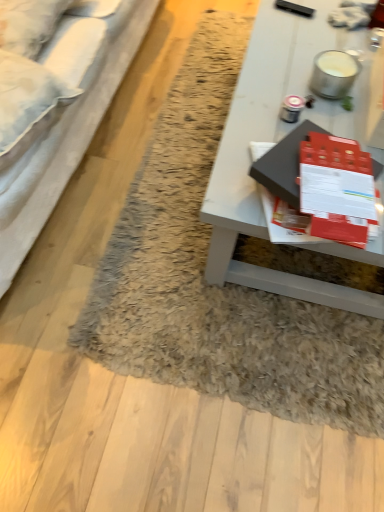
This screenshot has height=512, width=384. What do you see at coordinates (214, 286) in the screenshot?
I see `fuzzy rug at center` at bounding box center [214, 286].

The height and width of the screenshot is (512, 384). Find the location of `matte black book at center`. matte black book at center is located at coordinates (284, 164).

Locate an element on the screen. The image size is (384, 512). white glossy table at center is located at coordinates [274, 141].

You are a GUI agent. You are given a task and a screenshot of the screen. Output one action in this format:
    pyautogui.click(x=<x>, y=<y>)
    Task: Click on the pillow behind the white glossy table at center
    The width and height of the screenshot is (384, 512).
    Given the screenshot: What is the action you would take?
    pyautogui.click(x=29, y=24)

From a real-world perspective, is white fabric pillow at upper left over white glossy table at center?

Indeed, from a real-world perspective, white fabric pillow at upper left stands above white glossy table at center.

Could white glossy table at center be considered to be inside white fabric pillow at upper left?

That's incorrect, white glossy table at center is not inside white fabric pillow at upper left.

Is white glossy table at center at the back of white fabric pillow at upper left?

No, white fabric pillow at upper left's orientation is not away from white glossy table at center.

Can you tell me how much matte black book at center and white fabric pillow at upper left differ in facing direction?

The facing directions of matte black book at center and white fabric pillow at upper left are 86.6 degrees apart.

Based on the photo, from the image's perspective, is matte black book at center positioned above or below white fabric pillow at upper left?

Clearly, from the image's perspective, matte black book at center is below white fabric pillow at upper left.

From a real-world perspective, which is physically below, matte black book at center or white fabric pillow at upper left?

matte black book at center, from a real-world perspective.

Between matte black book at center and white fabric pillow at upper left, which one has smaller size?

Smaller between the two is matte black book at center.

Is white fabric pillow at upper left positioned in front of matte black book at center?

No, white fabric pillow at upper left is further to the viewer.

Between white fabric pillow at upper left and matte black book at center, which one has larger size?

Bigger between the two is white fabric pillow at upper left.

Is white fabric pillow at upper left touching matte black book at center?

white fabric pillow at upper left and matte black book at center are not in contact.

The height and width of the screenshot is (512, 384). I want to click on mat behind the white fabric studio couch at left, so click(214, 286).

Considering the relative positions of fuzzy rug at center and white fabric studio couch at left in the image provided, is fuzzy rug at center to the left of white fabric studio couch at left from the viewer's perspective?

In fact, fuzzy rug at center is to the right of white fabric studio couch at left.

Is fuzzy rug at center located outside white fabric studio couch at left?

Yes, fuzzy rug at center is located beyond the bounds of white fabric studio couch at left.

Between fuzzy rug at center and matte black book at center, which one is positioned in front?

matte black book at center is in front.

Is matte black book at center located within fuzzy rug at center?

Definitely not — matte black book at center is not inside fuzzy rug at center.

Does point (201, 274) come closer to viewer compared to point (296, 200)?

No.

Is fuzzy rug at center positioned far away from matte black book at center?

No.

At what (x,y) coordinates should I click in order to perform the action: click on table that is under the white fabric pillow at upper left (from a real-world perspective). Please return your answer as a coordinate pair (x, y). Looking at the image, I should click on (274, 141).

Can you confirm if white glossy table at center is wider than white fabric pillow at upper left?

Correct, the width of white glossy table at center exceeds that of white fabric pillow at upper left.

From the image's perspective, who appears lower, white glossy table at center or white fabric pillow at upper left?

white glossy table at center is shown below in the image.

From a real-world perspective, is white glossy table at center above or below white fabric pillow at upper left?

In terms of real-world spatial position, white glossy table at center is below white fabric pillow at upper left.

Is white glossy table at center with white fabric studio couch at left?

No.

Considering the sizes of objects white glossy table at center and white fabric studio couch at left in the image provided, who is taller, white glossy table at center or white fabric studio couch at left?

Standing taller between the two is white fabric studio couch at left.

From a real-world perspective, between white glossy table at center and white fabric studio couch at left, who is vertically lower?

From a 3D spatial view, white glossy table at center is below.

Between white glossy table at center and white fabric studio couch at left, which one appears on the right side from the viewer's perspective?

From the viewer's perspective, white glossy table at center appears more on the right side.

Where is `table lying below the white fabric pillow at upper left (from the image's perspective)`? table lying below the white fabric pillow at upper left (from the image's perspective) is located at coordinates (274, 141).

This screenshot has height=512, width=384. In order to click on magazine located underneath the white fabric pillow at upper left (from a real-world perspective) in this screenshot , I will do `click(284, 164)`.

When comparing their distances from fuzzy rug at center, does white fabric pillow at upper left or white glossy table at center seem further?

The object further to fuzzy rug at center is white fabric pillow at upper left.

Looking at the image, which one is located further to matte black book at center, white fabric studio couch at left or white fabric pillow at upper left?

Based on the image, white fabric pillow at upper left appears to be further to matte black book at center.

Considering their positions, is white fabric pillow at upper left positioned closer to fuzzy rug at center than white fabric studio couch at left?

white fabric studio couch at left.

Which object lies nearer to the anchor point fuzzy rug at center, white fabric pillow at upper left or matte black book at center?

matte black book at center is positioned closer to the anchor fuzzy rug at center.

Estimate the real-world distances between objects in this image. Which object is closer to fuzzy rug at center, matte black book at center or white glossy table at center?

white glossy table at center is closer to fuzzy rug at center.

Considering their positions, is fuzzy rug at center positioned closer to matte black book at center than white glossy table at center?

Based on the image, white glossy table at center appears to be nearer to matte black book at center.

When comparing their distances from white fabric pillow at upper left, does matte black book at center or white glossy table at center seem further?

matte black book at center.

From the image, which object appears to be nearer to fuzzy rug at center, white fabric studio couch at left or matte black book at center?

white fabric studio couch at left is closer to fuzzy rug at center.

You are a GUI agent. You are given a task and a screenshot of the screen. Output one action in this format:
    pyautogui.click(x=<x>, y=<y>)
    Task: Click on the mat between white fabric pillow at upper left and white glossy table at center from left to right
    Image resolution: width=384 pixels, height=512 pixels.
    Given the screenshot: What is the action you would take?
    pyautogui.click(x=214, y=286)

At what (x,y) coordinates should I click in order to perform the action: click on magazine between white fabric studio couch at left and fuzzy rug at center in the horizontal direction. Please return your answer as a coordinate pair (x, y). The width and height of the screenshot is (384, 512). Looking at the image, I should click on (284, 164).

The image size is (384, 512). Identify the location of mat between white fabric studio couch at left and white glossy table at center in the horizontal direction. (214, 286).

Identify the location of pillow between white fabric studio couch at left and white glossy table at center from left to right. (29, 24).